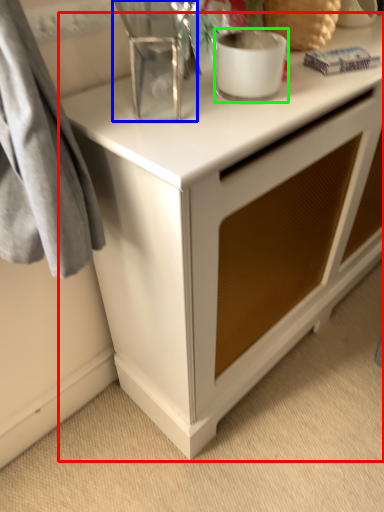
Question: Considering the real-world distances, which object is closest to desk (highlighted by a red box)? appliance (highlighted by a blue box) or appliance (highlighted by a green box).

Choices:
 (A) appliance
 (B) appliance

Answer: (A)